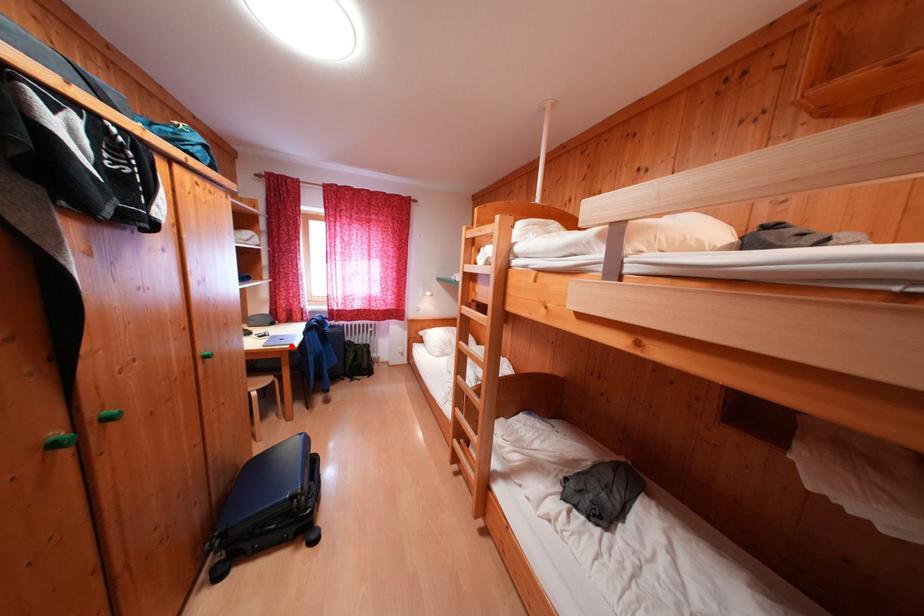
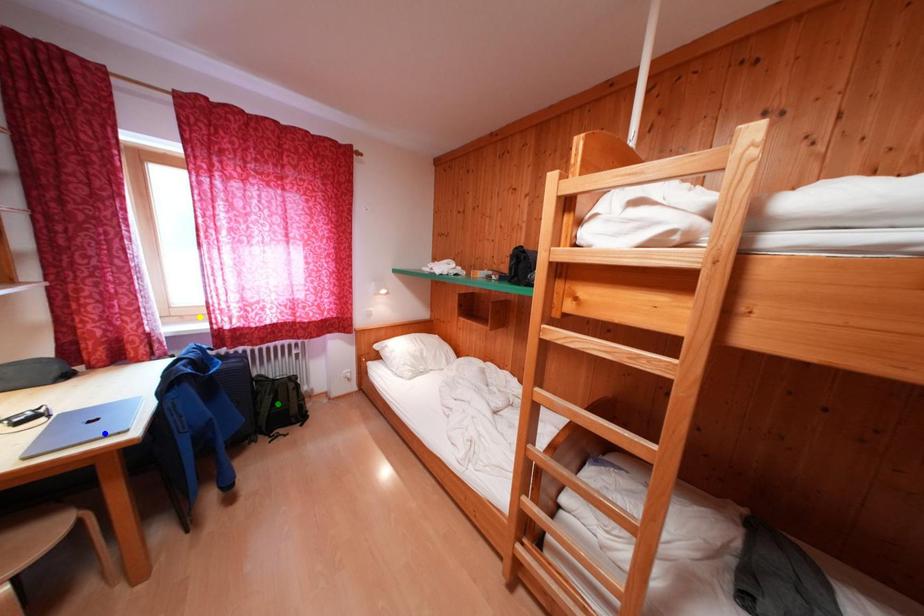
Question: I am providing you with two images of the same scene from different viewpoints. A red point is marked on the first image. You are given multiple points on the second image. Can you choose the point in image 2 that corresponds to the point in image 1?

Choices:
 (A) blue point
 (B) green point
 (C) yellow point

Answer: (A)